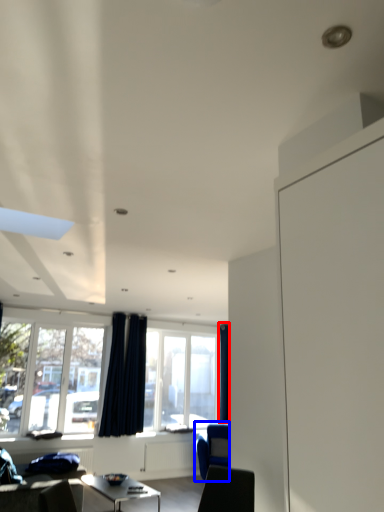
Question: Among these objects, which one is farthest to the camera, curtain (highlighted by a red box) or armchair (highlighted by a blue box)?

Choices:
 (A) curtain
 (B) armchair

Answer: (A)